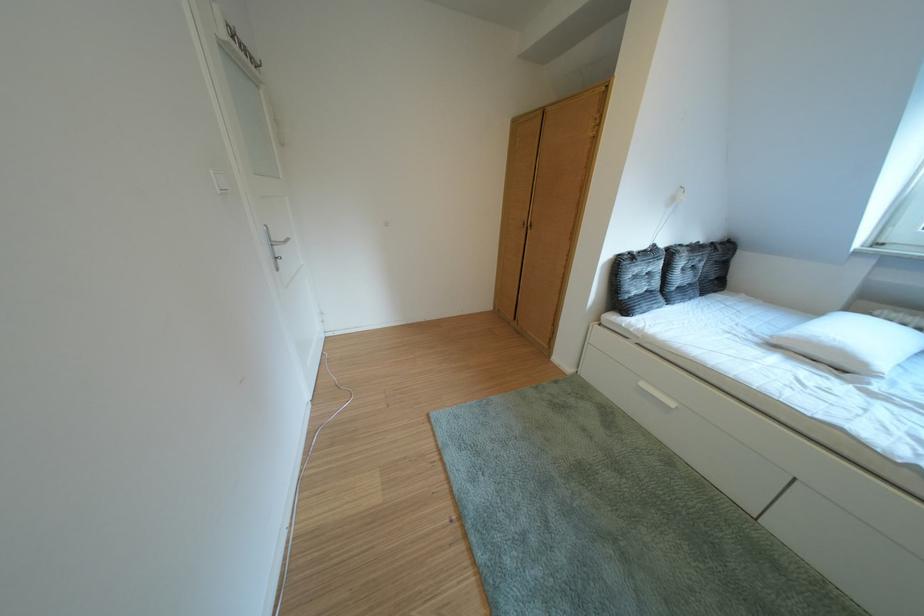
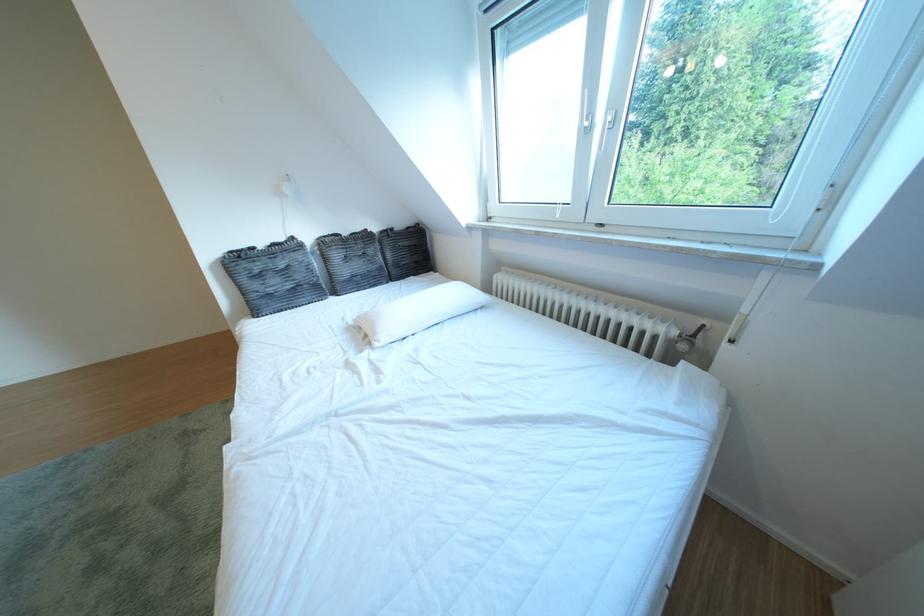
Question: In a continuous first-person perspective shot, in which direction is the camera moving?

Choices:
 (A) Left
 (B) Right
 (C) Forward
 (D) Backward

Answer: (B)